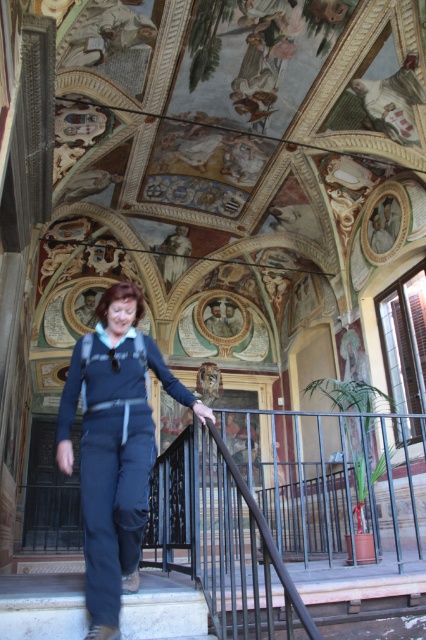
You are standing at the bottom of the staircase in the historical building. You see two points marked on the ceiling fresco. The first point is at coordinates point (141, 483) and the second is at point (135, 627). If you were to walk towards the second point, would you be moving forward or backward relative to the staircase direction?

Since point (141, 483) is behind point (135, 627), moving towards the second point would mean moving backward relative to the staircase direction because the second point is closer to the entrance or starting point of the staircase.

You are an architect analyzing the spatial layout of the historical building. You notice the dark blue fabric pants at lower left. Where exactly is this object positioned in the image?

The dark blue fabric pants at lower left is located at point [115,445].

You are an architect inspecting the historical building. You notice the dark blue fabric pants at lower left and the white marble stairs at lower left. Which object is positioned higher in the image?

The dark blue fabric pants at lower left is located above the white marble stairs at lower left, so it is positioned higher in the image.